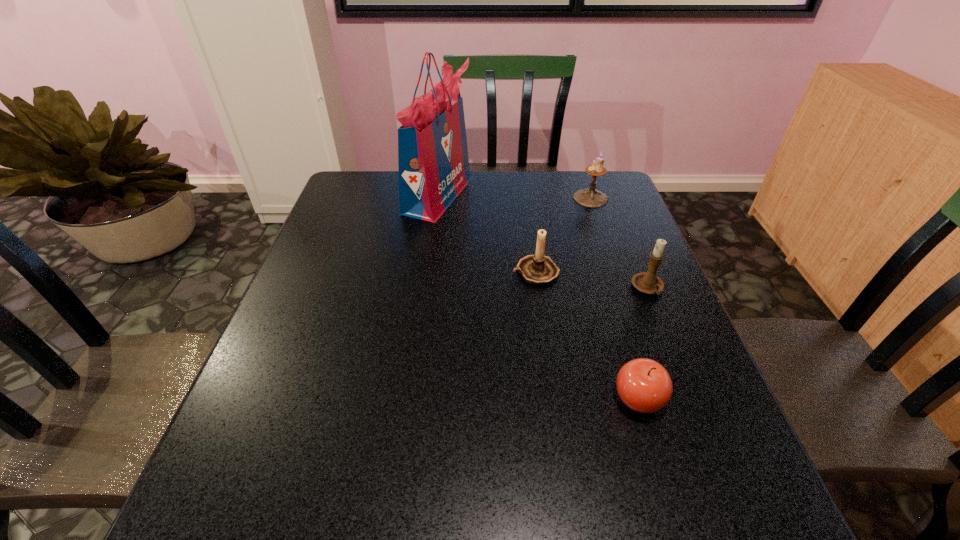
Identify the location of grocery bag that is at the far edge. The width and height of the screenshot is (960, 540). (433, 163).

Where is `candle holder that is at the far edge`? candle holder that is at the far edge is located at coordinates (589, 197).

Where is `apple positioned at the right edge`? apple positioned at the right edge is located at coordinates (644, 385).

The height and width of the screenshot is (540, 960). In order to click on object located at the far right corner in this screenshot , I will do `click(589, 197)`.

The width and height of the screenshot is (960, 540). Find the location of `free location at the far edge of the desktop`. free location at the far edge of the desktop is located at coordinates (474, 205).

The height and width of the screenshot is (540, 960). In order to click on free region at the near edge in this screenshot , I will do `click(453, 514)`.

The image size is (960, 540). What are the coordinates of `vacant area at the left edge` in the screenshot? It's located at (338, 293).

Locate an element on the screen. Image resolution: width=960 pixels, height=540 pixels. vacant space at the right edge of the desktop is located at coordinates (648, 316).

Where is `vacant space at the far left corner`? vacant space at the far left corner is located at coordinates click(377, 189).

Image resolution: width=960 pixels, height=540 pixels. I want to click on free spot at the far right corner of the desktop, so click(x=567, y=171).